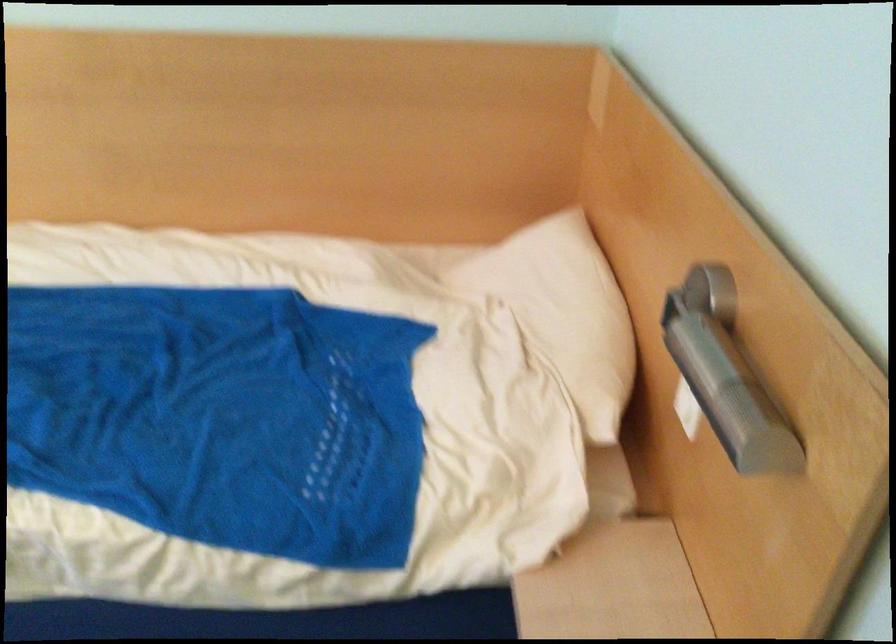
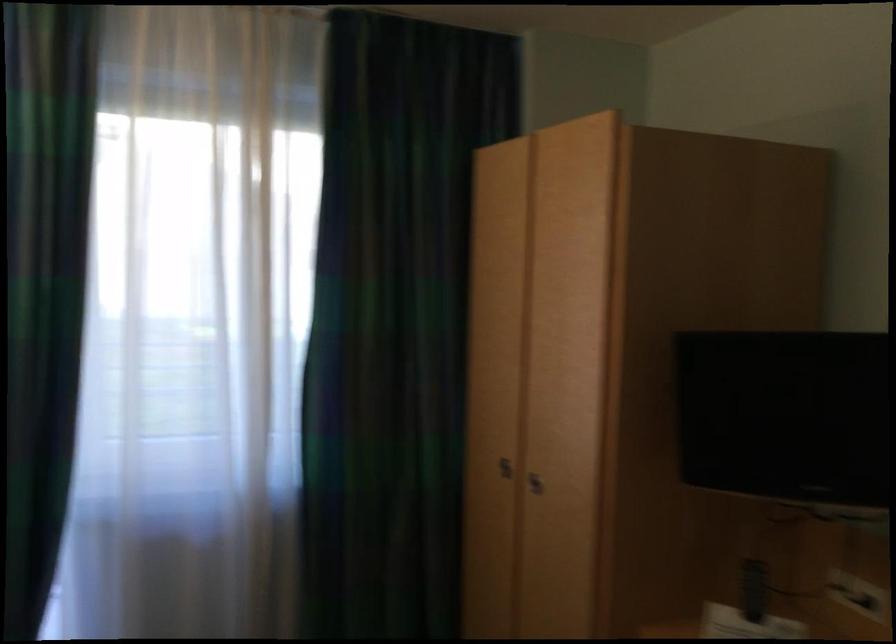
Question: The camera is either moving clockwise (left) or counter-clockwise (right) around the object. The first image is from the beginning of the video and the second image is from the end. Is the camera moving left or right when shooting the video?

Choices:
 (A) Left
 (B) Right

Answer: (B)